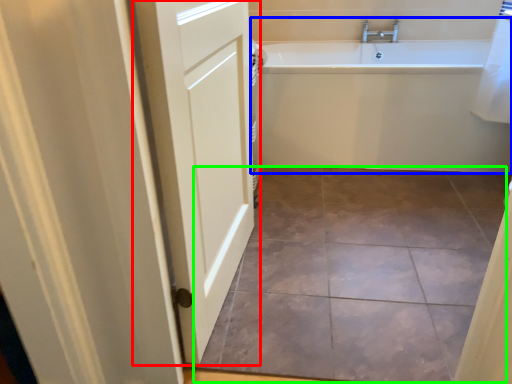
Question: Which is farther away from door (highlighted by a red box)? bathtub (highlighted by a blue box) or ceramic tile (highlighted by a green box)?

Choices:
 (A) bathtub
 (B) ceramic tile

Answer: (A)